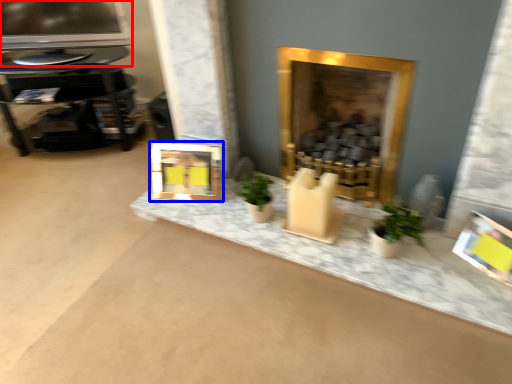
Question: Among these objects, which one is nearest to the camera, television (highlighted by a red box) or picture frame (highlighted by a blue box)?

Choices:
 (A) television
 (B) picture frame

Answer: (B)